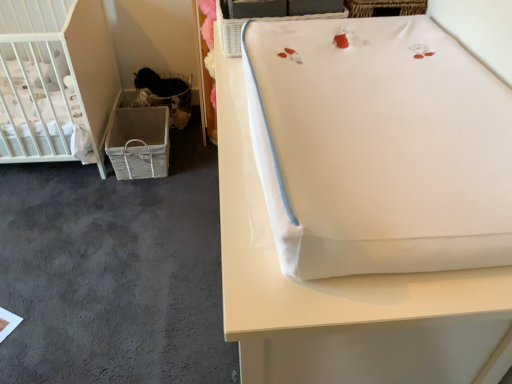
Question: Is woven fabric basket at lower left closer to camera compared to white fabric changing pad at upper right?

Choices:
 (A) yes
 (B) no

Answer: (B)

Question: Does woven fabric basket at lower left have a larger size compared to white fabric changing pad at upper right?

Choices:
 (A) no
 (B) yes

Answer: (A)

Question: Is woven fabric basket at lower left further to camera compared to white fabric changing pad at upper right?

Choices:
 (A) no
 (B) yes

Answer: (B)

Question: Is woven fabric basket at lower left to the left of white fabric changing pad at upper right from the viewer's perspective?

Choices:
 (A) no
 (B) yes

Answer: (B)

Question: Are woven fabric basket at lower left and white fabric changing pad at upper right beside each other?

Choices:
 (A) no
 (B) yes

Answer: (A)

Question: Considering the positions of point (144, 99) and point (241, 367), is point (144, 99) closer or farther from the camera than point (241, 367)?

Choices:
 (A) farther
 (B) closer

Answer: (A)

Question: Is woven fabric basket at lower left, the 2th basket in the front-to-back sequence, wider or thinner than white fabric changing pad at upper right?

Choices:
 (A) thin
 (B) wide

Answer: (A)

Question: Relative to white fabric changing pad at upper right, is woven fabric basket at lower left, the 2th basket viewed from the right, in front or behind?

Choices:
 (A) behind
 (B) front

Answer: (A)

Question: Is woven fabric basket at lower left, the 2th basket viewed from the right, taller or shorter than white fabric changing pad at upper right?

Choices:
 (A) short
 (B) tall

Answer: (A)

Question: Looking at the image, does woven fabric basket at lower left, the 1th basket from the back, seem bigger or smaller compared to white matte crib at left?

Choices:
 (A) big
 (B) small

Answer: (B)

Question: Considering the positions of point (175, 112) and point (1, 51), is point (175, 112) closer or farther from the camera than point (1, 51)?

Choices:
 (A) farther
 (B) closer

Answer: (A)

Question: Is woven fabric basket at lower left, the 2th basket in the front-to-back sequence, inside the boundaries of white matte crib at left, or outside?

Choices:
 (A) inside
 (B) outside

Answer: (B)

Question: Is woven fabric basket at lower left, the 2th basket in the front-to-back sequence, taller or shorter than white matte crib at left?

Choices:
 (A) tall
 (B) short

Answer: (B)

Question: From the image's perspective, is white fabric changing pad at upper right above or below white wicker basket at upper center, arranged as the second basket when viewed from the left?

Choices:
 (A) below
 (B) above

Answer: (A)

Question: Relative to white wicker basket at upper center, the first basket positioned from the front, is white fabric changing pad at upper right in front or behind?

Choices:
 (A) front
 (B) behind

Answer: (A)